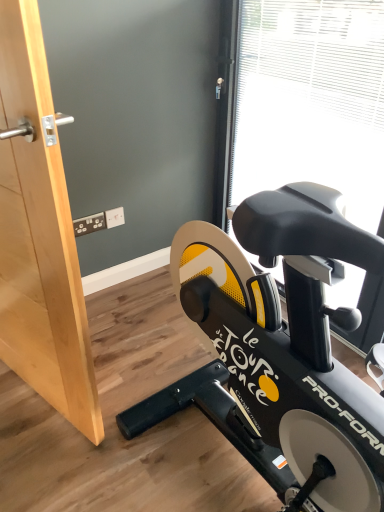
Question: Considering the positions of wooden door at left and transparent plastic window screen at upper right in the image, is wooden door at left wider or thinner than transparent plastic window screen at upper right?

Choices:
 (A) thin
 (B) wide

Answer: (A)

Question: Based on their positions, is wooden door at left located to the left or right of transparent plastic window screen at upper right?

Choices:
 (A) right
 (B) left

Answer: (B)

Question: Estimate the real-world distances between objects in this image. Which object is closer to the transparent plastic window screen at upper right?

Choices:
 (A) wooden door at left
 (B) black matte stationary bicycle at lower right

Answer: (B)

Question: Considering the real-world distances, which object is closest to the transparent plastic window screen at upper right?

Choices:
 (A) wooden door at left
 (B) black matte stationary bicycle at lower right

Answer: (B)